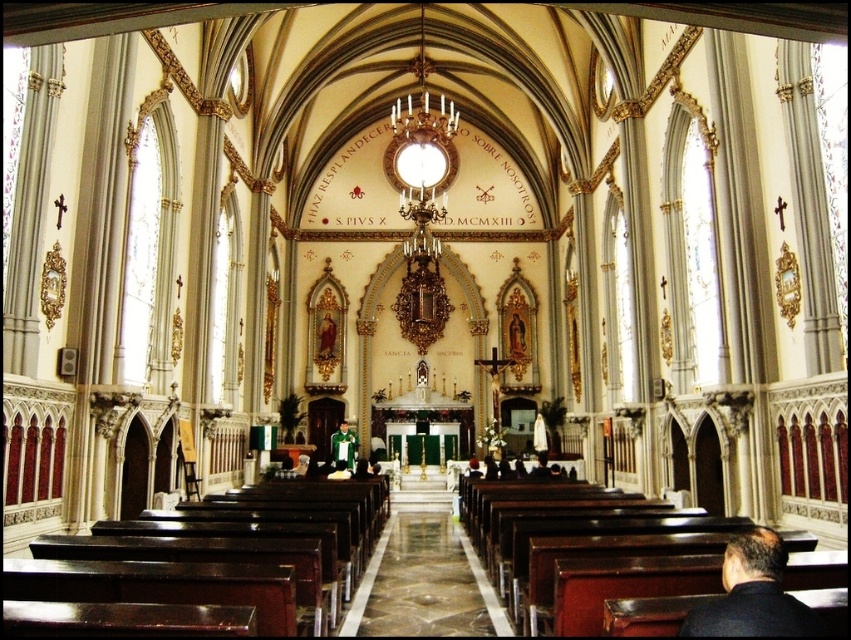
What do you see at coordinates (752, 595) in the screenshot? This screenshot has width=851, height=640. I see `dark brown leather jacket at lower right` at bounding box center [752, 595].

Who is more distant from viewer, (734, 540) or (344, 420)?

The point (344, 420) is behind.

Where is `dark brown leather jacket at lower right`? The image size is (851, 640). dark brown leather jacket at lower right is located at coordinates (752, 595).